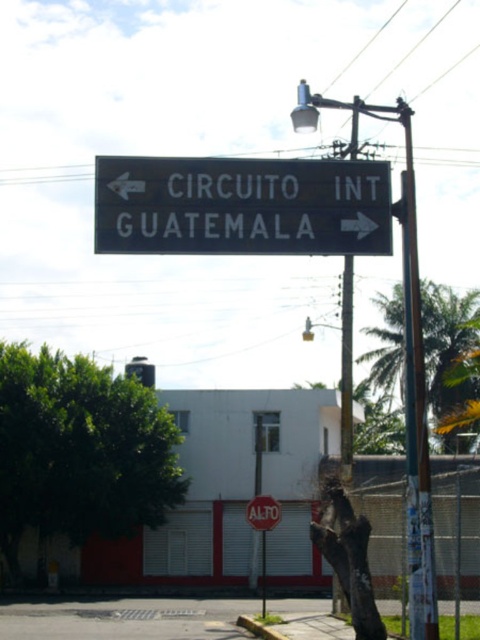
Question: Where is black metal sign at center located in relation to red matte stop sign at center in the image?

Choices:
 (A) right
 (B) left

Answer: (B)

Question: Does black metal sign at center have a lesser width compared to red matte stop sign at center?

Choices:
 (A) no
 (B) yes

Answer: (A)

Question: Does black metal sign at center have a greater width compared to red matte stop sign at center?

Choices:
 (A) yes
 (B) no

Answer: (A)

Question: Which of the following is the farthest from the observer?

Choices:
 (A) black metal sign at center
 (B) red matte stop sign at center

Answer: (B)

Question: Which point is closer to the camera?

Choices:
 (A) red matte stop sign at center
 (B) black metal sign at center

Answer: (B)